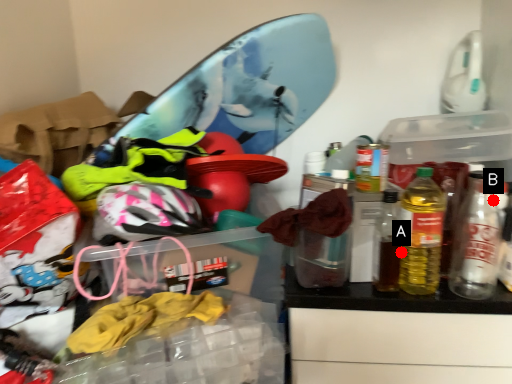
Question: Two points are circled on the image, labeled by A and B beside each circle. Which point is closer to the camera taking this photo?

Choices:
 (A) A is closer
 (B) B is closer

Answer: (B)